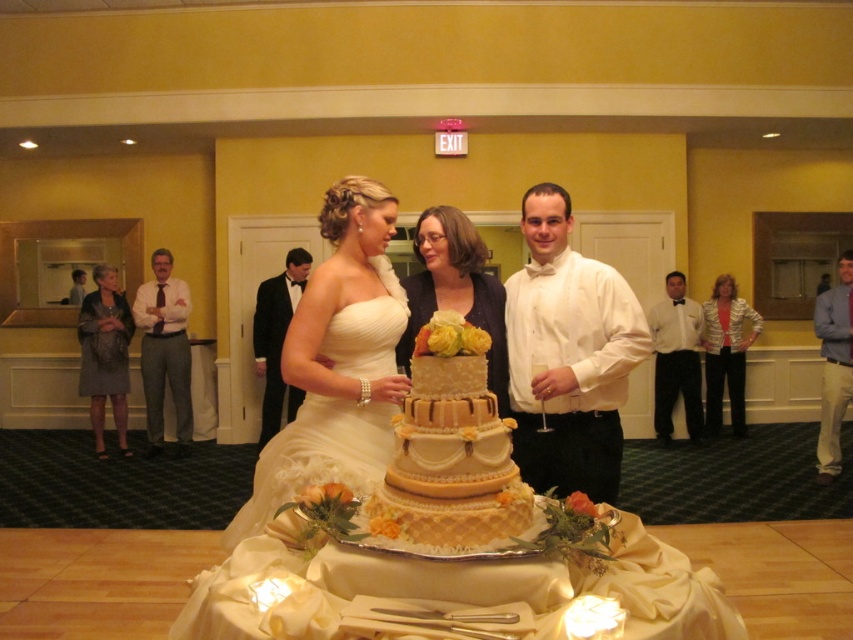
What do you see at coordinates (450, 449) in the screenshot? The height and width of the screenshot is (640, 853). I see `beige fondant cake at center` at bounding box center [450, 449].

Does beige fondant cake at center appear on the left side of light blue shirt at right?

Indeed, beige fondant cake at center is positioned on the left side of light blue shirt at right.

Who is more distant from viewer, (421, 397) or (830, 358)?

Point (830, 358)

This screenshot has width=853, height=640. In order to click on beige fondant cake at center in this screenshot , I will do 450,449.

Can you confirm if striped fabric jacket at center is thinner than gray textured dress at left?

No, striped fabric jacket at center is not thinner than gray textured dress at left.

How much distance is there between striped fabric jacket at center and gray textured dress at left?

striped fabric jacket at center is 16.34 feet away from gray textured dress at left.

You are a GUI agent. You are given a task and a screenshot of the screen. Output one action in this format:
    pyautogui.click(x=<x>, y=<y>)
    Task: Click on the striped fabric jacket at center
    This screenshot has height=640, width=853.
    Given the screenshot: What is the action you would take?
    pyautogui.click(x=693, y=356)

Can you confirm if matte gold dress at center is positioned above white satin bow tie at center?

Correct, matte gold dress at center is located above white satin bow tie at center.

Can you confirm if matte gold dress at center is thinner than white satin bow tie at center?

Yes.

In order to click on matte gold dress at center in this screenshot , I will do `click(456, 289)`.

Image resolution: width=853 pixels, height=640 pixels. In order to click on matte gold dress at center in this screenshot , I will do `click(456, 289)`.